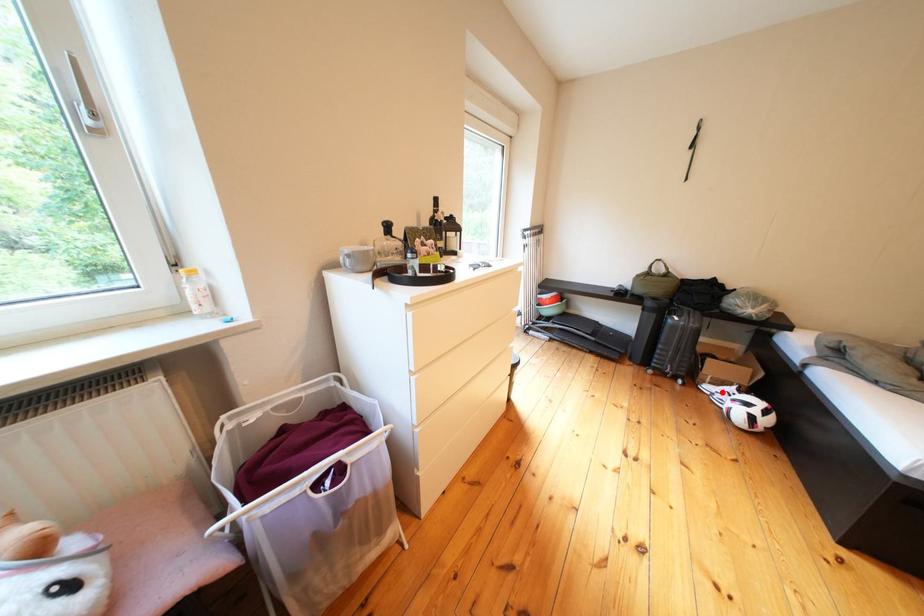
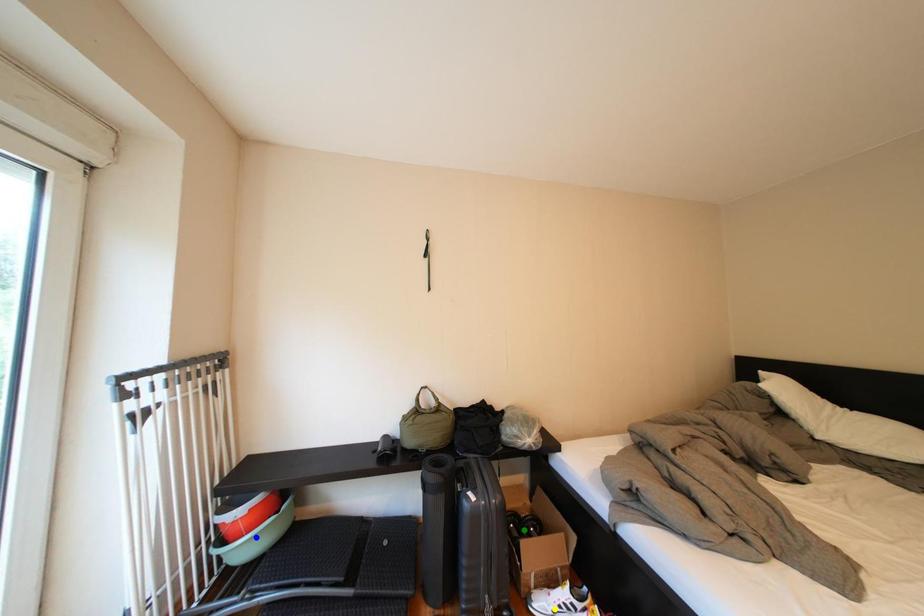
Question: I am providing you with two images of the same scene from different viewpoints. A red point is marked on the first image. You are given multiple points on the second image. Which spot in image 2 lines up with the point in image 1?

Choices:
 (A) blue point
 (B) green point
 (C) yellow point

Answer: (C)